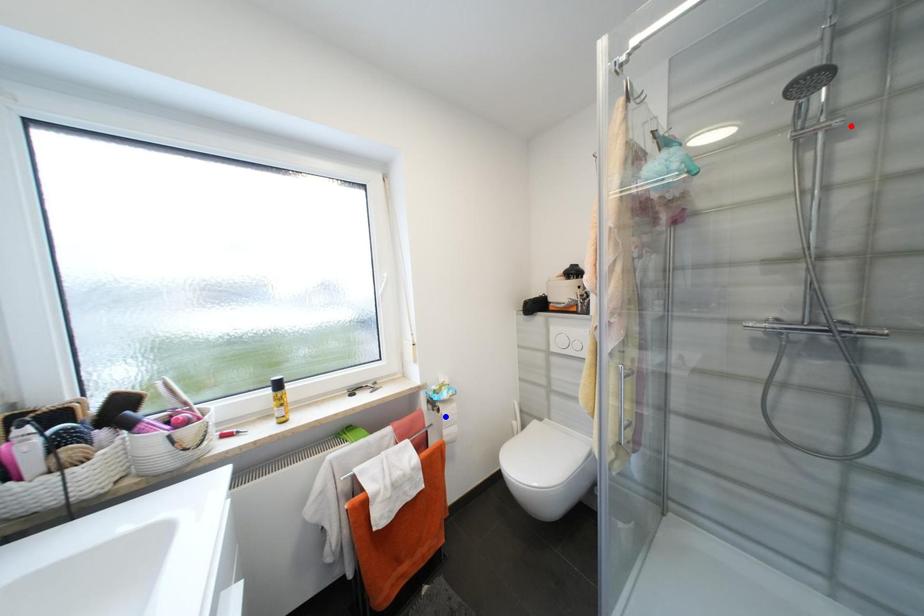
Question: Two points are marked on the image. Which point is closer to the camera?

Choices:
 (A) Blue point is closer.
 (B) Red point is closer.

Answer: (B)